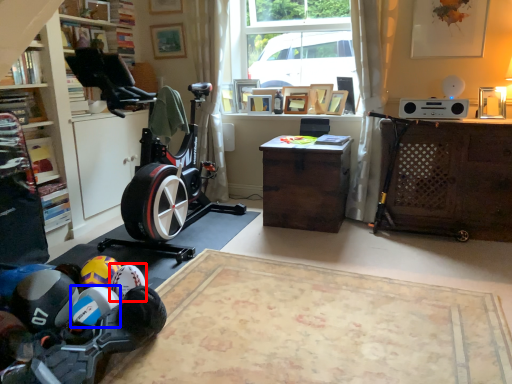
Question: Among these objects, which one is farthest to the camera, toy (highlighted by a red box) or toy (highlighted by a blue box)?

Choices:
 (A) toy
 (B) toy

Answer: (A)